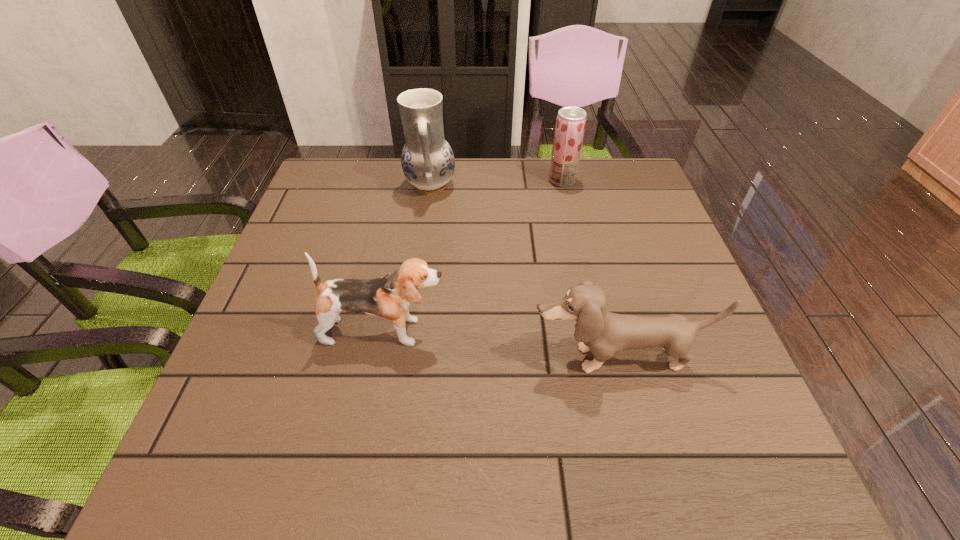
Locate an element on the screen. This screenshot has width=960, height=540. pottery is located at coordinates [x=427, y=160].

The image size is (960, 540). I want to click on the left puppy, so click(x=388, y=297).

Find the location of `fruit juice`. fruit juice is located at coordinates (570, 124).

Image resolution: width=960 pixels, height=540 pixels. Identify the location of the right puppy. (604, 333).

The width and height of the screenshot is (960, 540). In order to click on free space located 0.190m on the front of the pottery in this screenshot , I will do `click(420, 255)`.

You are a GUI agent. You are given a task and a screenshot of the screen. Output one action in this format:
    pyautogui.click(x=<x>, y=<y>)
    Task: Click on the vacant position located at the face of the left puppy
    
    Given the screenshot: What is the action you would take?
    pyautogui.click(x=609, y=332)

At what (x,y) coordinates should I click in order to perform the action: click on free space located on the front of the fruit juice. Please return your answer as a coordinate pair (x, y). Looking at the image, I should click on (567, 203).

You are a GUI agent. You are given a task and a screenshot of the screen. Output one action in this format:
    pyautogui.click(x=<x>, y=<y>)
    Task: Click on the vacant space located 0.130m at the face of the right puppy
    
    Given the screenshot: What is the action you would take?
    pyautogui.click(x=640, y=447)

Locate an element on the screen. This screenshot has width=960, height=540. pottery positioned at the far edge is located at coordinates (427, 160).

I want to click on fruit juice at the far edge, so click(x=570, y=124).